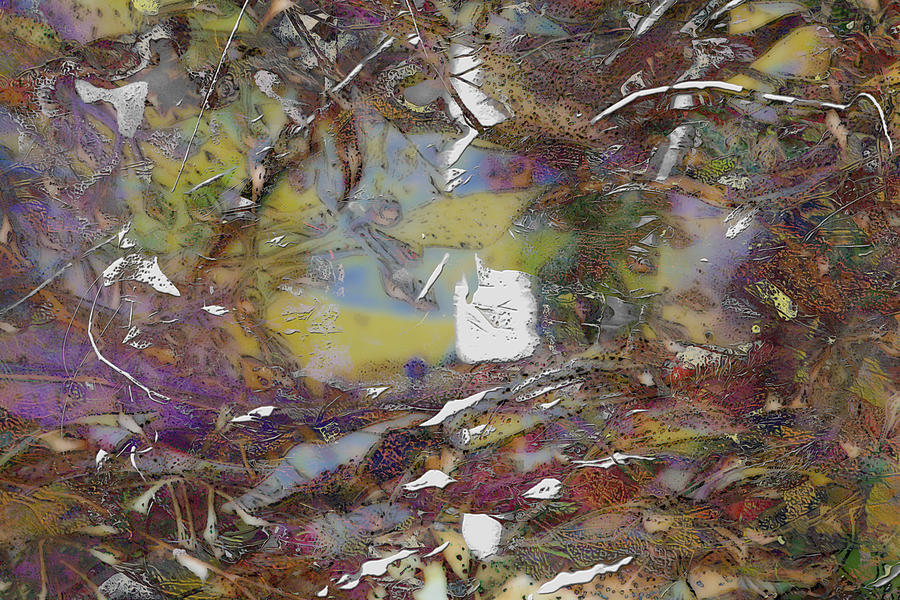
The width and height of the screenshot is (900, 600). What are the coordinates of `bottom left edge of painting` in the screenshot? It's located at (4, 596).